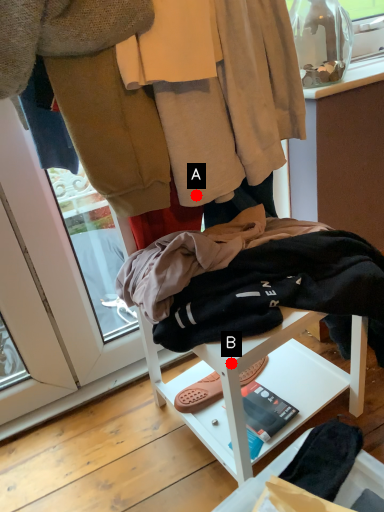
Question: Two points are circled on the image, labeled by A and B beside each circle. Among these points, which one is nearest to the camera?

Choices:
 (A) A is closer
 (B) B is closer

Answer: (B)